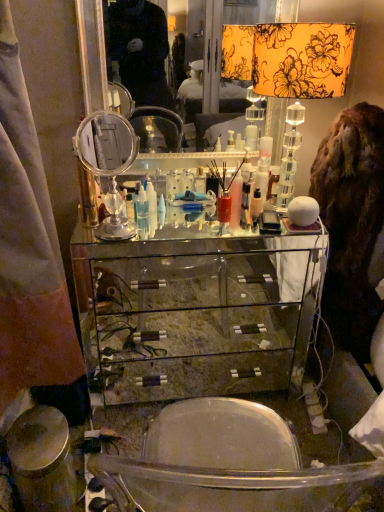
At what (x,y) coordinates should I click in order to perform the action: click on translucent plastic bottle at center, the 1th toiletry from the right. Please return your answer as a coordinate pair (x, y). The image size is (384, 512). Looking at the image, I should click on (262, 177).

In order to click on polished silver mirror at center, which appears as the 2th table lamp when viewed from the right in this screenshot , I will do `click(108, 166)`.

This screenshot has height=512, width=384. Describe the element at coordinates (31, 256) in the screenshot. I see `satin fabric curtain at left` at that location.

Identify the location of clear glass mirror at center. (119, 35).

From the image's perspective, between translucent plastic bottle at center, which appears as the 2th toiletry when viewed from the left, and polished silver mirror at center, the first table lamp in the left-to-right sequence, who is located below?

From the image's view, polished silver mirror at center, the first table lamp in the left-to-right sequence, is below.

Between translucent plastic bottle at center, the 1th toiletry from the top, and polished silver mirror at center, the first table lamp in the left-to-right sequence, which one is positioned behind?

translucent plastic bottle at center, the 1th toiletry from the top, is more distant.

Can you confirm if translucent plastic bottle at center, which appears as the 2th toiletry when viewed from the left, is smaller than polished silver mirror at center, which appears as the 2th table lamp when viewed from the right?

Indeed, translucent plastic bottle at center, which appears as the 2th toiletry when viewed from the left, has a smaller size compared to polished silver mirror at center, which appears as the 2th table lamp when viewed from the right.

Can we say translucent plastic bottle at center, which appears as the 2th toiletry when viewed from the left, lies outside polished silver mirror at center, which appears as the 2th table lamp when viewed from the right?

Yes, translucent plastic bottle at center, which appears as the 2th toiletry when viewed from the left, is not within polished silver mirror at center, which appears as the 2th table lamp when viewed from the right.

From a real-world perspective, is translucent plastic bottle at center, the 1th toiletry from the top, physically below brown furry coat at right?

No, from a real-world perspective, translucent plastic bottle at center, the 1th toiletry from the top, is not under brown furry coat at right.

Consider the image. Which object is closer to the camera taking this photo, translucent plastic bottle at center, the second toiletry in the bottom-to-top sequence, or brown furry coat at right?

brown furry coat at right is more forward.

Based on the photo, is brown furry coat at right at the back of translucent plastic bottle at center, the 1th toiletry from the top?

No.

Between translucent plastic bottle at center, the 1th toiletry from the right, and brown furry coat at right, which one has less height?

translucent plastic bottle at center, the 1th toiletry from the right, is shorter.

Is white plastic cone at center, the second toiletry viewed from the right, spatially inside translucent plastic bottle at center, the 1th toiletry from the right, or outside of it?

white plastic cone at center, the second toiletry viewed from the right, is located beyond the bounds of translucent plastic bottle at center, the 1th toiletry from the right.

Between white plastic cone at center, the 2th toiletry in the top-to-bottom sequence, and translucent plastic bottle at center, the 1th toiletry from the top, which one has smaller size?

white plastic cone at center, the 2th toiletry in the top-to-bottom sequence.

Is white plastic cone at center, the second toiletry viewed from the right, closer to camera compared to translucent plastic bottle at center, the 1th toiletry from the top?

Yes, it is in front of translucent plastic bottle at center, the 1th toiletry from the top.

Considering the positions of objects white plastic cone at center, acting as the first toiletry starting from the bottom, and translucent plastic bottle at center, the 1th toiletry from the right, in the image provided, who is more to the left, white plastic cone at center, acting as the first toiletry starting from the bottom, or translucent plastic bottle at center, the 1th toiletry from the right,?

From the viewer's perspective, white plastic cone at center, acting as the first toiletry starting from the bottom, appears more on the left side.

This screenshot has height=512, width=384. Identify the location of cabinetry that is on the right side of clear glass mirror at center. (197, 314).

Is point (302, 337) more distant than point (237, 21)?

No, (302, 337) is in front of (237, 21).

Considering their positions, is clear glass cabinet at center located in front of or behind clear glass mirror at center?

In the image, clear glass cabinet at center appears in front of clear glass mirror at center.

This screenshot has height=512, width=384. Find the location of `cabinetry below the clear glass mirror at center (from a real-world perspective)`. cabinetry below the clear glass mirror at center (from a real-world perspective) is located at coordinates (197, 314).

Consider the image. Is clear glass mirror at center wider than clear glass cabinet at center?

No.

Does clear glass mirror at center have a smaller size compared to clear glass cabinet at center?

Indeed, clear glass mirror at center has a smaller size compared to clear glass cabinet at center.

From a real-world perspective, between clear glass cabinet at center and satin fabric curtain at left, who is vertically higher?

satin fabric curtain at left is physically above.

From the image's perspective, which one is positioned higher, clear glass cabinet at center or satin fabric curtain at left?

satin fabric curtain at left appears higher in the image.

The height and width of the screenshot is (512, 384). Identify the location of cabinetry located underneath the satin fabric curtain at left (from a real-world perspective). (197, 314).

In terms of height, does satin fabric curtain at left look taller or shorter compared to floral fabric lampshade at upper right, placed as the 2th table lamp when sorted from left to right?

Clearly, satin fabric curtain at left is taller compared to floral fabric lampshade at upper right, placed as the 2th table lamp when sorted from left to right.

Based on the photo, would you say satin fabric curtain at left is outside floral fabric lampshade at upper right, placed as the 2th table lamp when sorted from left to right?

Yes, satin fabric curtain at left is located beyond the bounds of floral fabric lampshade at upper right, placed as the 2th table lamp when sorted from left to right.

Is satin fabric curtain at left thinner than floral fabric lampshade at upper right, which is the 1th table lamp in right-to-left order?

No.

Which object is further away from the camera, satin fabric curtain at left or floral fabric lampshade at upper right, which is the 1th table lamp in right-to-left order?

floral fabric lampshade at upper right, which is the 1th table lamp in right-to-left order.

Find the location of a particular element. the 1st toiletry located beneath the polished silver mirror at center, the first table lamp in the left-to-right sequence (from a real-world perspective) is located at coordinates (262, 177).

In order to click on fur coat below the translucent plastic bottle at center, the 1th toiletry from the top (from the image's perspective) in this screenshot , I will do `click(351, 223)`.

Considering their positions, is clear glass mirror at center positioned closer to satin fabric curtain at left than polished silver mirror at center, which appears as the 2th table lamp when viewed from the right?

polished silver mirror at center, which appears as the 2th table lamp when viewed from the right, lies closer to satin fabric curtain at left than the other object.

Looking at the image, which one is located closer to floral fabric lampshade at upper right, placed as the 2th table lamp when sorted from left to right, polished silver mirror at center, which appears as the 2th table lamp when viewed from the right, or clear glass cabinet at center?

polished silver mirror at center, which appears as the 2th table lamp when viewed from the right.

Considering their positions, is clear glass cabinet at center positioned closer to translucent plastic bottle at center, the 1th toiletry from the right, than clear glass mirror at center?

clear glass cabinet at center.

Consider the image. From the image, which object appears to be farther from polished silver mirror at center, which appears as the 2th table lamp when viewed from the right, clear glass mirror at center or white plastic cone at center, the second toiletry viewed from the right?

The object further to polished silver mirror at center, which appears as the 2th table lamp when viewed from the right, is clear glass mirror at center.

When comparing their distances from polished silver mirror at center, which appears as the 2th table lamp when viewed from the right, does white plastic cone at center, the 1th toiletry in the left-to-right sequence, or clear glass cabinet at center seem closer?

white plastic cone at center, the 1th toiletry in the left-to-right sequence, is positioned closer to the anchor polished silver mirror at center, which appears as the 2th table lamp when viewed from the right.

Estimate the real-world distances between objects in this image. Which object is closer to white plastic cone at center, the 2th toiletry in the top-to-bottom sequence, floral fabric lampshade at upper right, placed as the 2th table lamp when sorted from left to right, or polished silver mirror at center, the first table lamp in the left-to-right sequence?

Based on the image, polished silver mirror at center, the first table lamp in the left-to-right sequence, appears to be nearer to white plastic cone at center, the 2th toiletry in the top-to-bottom sequence.

Which object lies nearer to the anchor point floral fabric lampshade at upper right, which is the 1th table lamp in right-to-left order, clear glass mirror at center or polished silver mirror at center, which appears as the 2th table lamp when viewed from the right?

polished silver mirror at center, which appears as the 2th table lamp when viewed from the right, is closer to floral fabric lampshade at upper right, which is the 1th table lamp in right-to-left order.

Looking at the image, which one is located further to brown furry coat at right, satin fabric curtain at left or polished silver mirror at center, the first table lamp in the left-to-right sequence?

The object further to brown furry coat at right is satin fabric curtain at left.

Image resolution: width=384 pixels, height=512 pixels. I want to click on mirror between satin fabric curtain at left and white plastic cone at center, acting as the first toiletry starting from the bottom, along the z-axis, so click(119, 35).

This screenshot has width=384, height=512. I want to click on mirror situated between polished silver mirror at center, the first table lamp in the left-to-right sequence, and brown furry coat at right from left to right, so click(x=119, y=35).

You are a GUI agent. You are given a task and a screenshot of the screen. Output one action in this format:
    pyautogui.click(x=<x>, y=<y>)
    Task: Click on the fur coat located between satin fabric curtain at left and translucent plastic bottle at center, the second toiletry in the bottom-to-top sequence, in the depth direction
    This screenshot has height=512, width=384.
    Given the screenshot: What is the action you would take?
    pyautogui.click(x=351, y=223)

Where is `mirror situated between white plastic cone at center, the 2th toiletry in the top-to-bottom sequence, and floral fabric lampshade at upper right, placed as the 2th table lamp when sorted from left to right, from left to right`? The width and height of the screenshot is (384, 512). mirror situated between white plastic cone at center, the 2th toiletry in the top-to-bottom sequence, and floral fabric lampshade at upper right, placed as the 2th table lamp when sorted from left to right, from left to right is located at coordinates (119, 35).